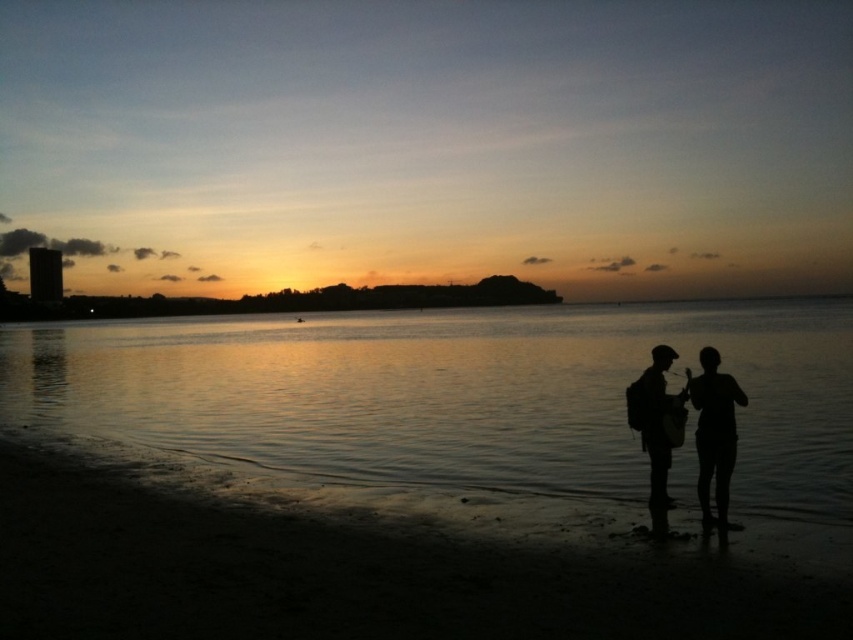
You are standing on the beach facing the sunset. There is a point marked at coordinates (x=451, y=394). What is located at this point?

The point at coordinates (x=451, y=394) marks glistening water at center.

You are a photographer carrying a camera bag and want to place your silhouette backpack at lower right and black matte backpack at lower right on the beach without them overlapping. Given that your camera bag is 20 inches wide, what is the minimum distance you need to keep between the two backpacks to ensure they don

The silhouette backpack at lower right must be at least 20 inches away from the black matte backpack at lower right to prevent overlapping. Since the distance between them is 25.12 inches, which is greater than 20 inches, they won